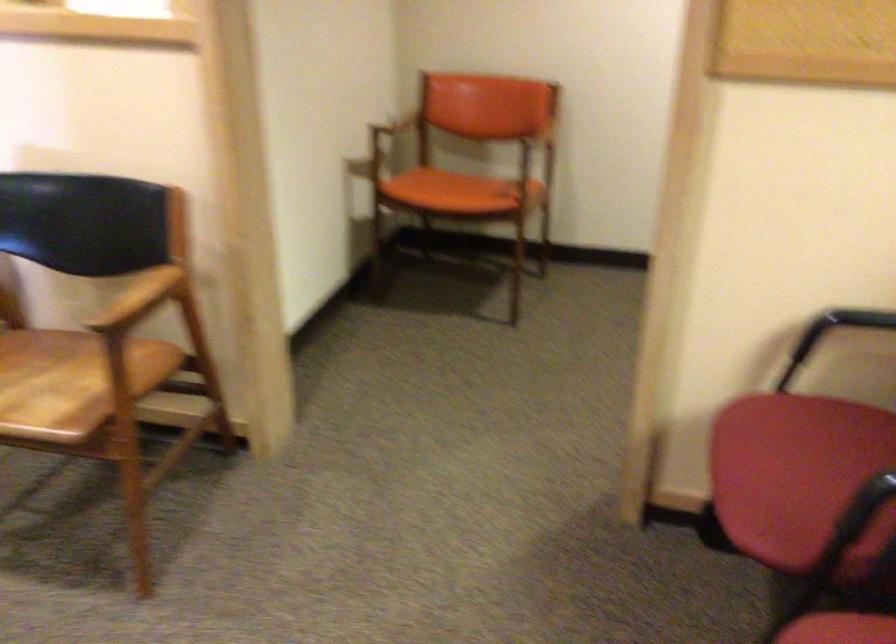
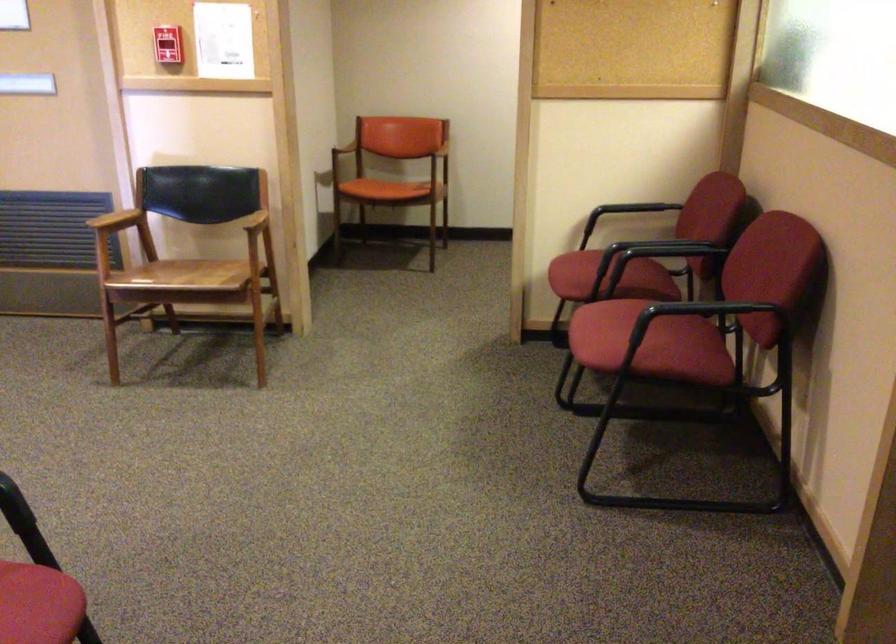
Find the pixel in the second image that matches [865,506] in the first image.

(598, 258)